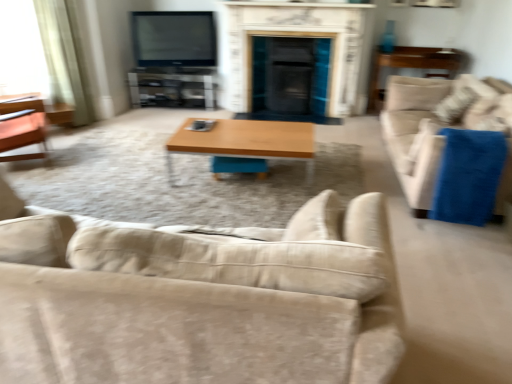
Question: Does wooden/matte coffee table at center contain beige fabric couch at right, which is the 1th studio couch in back-to-front order?

Choices:
 (A) yes
 (B) no

Answer: (B)

Question: From a real-world perspective, is wooden/matte coffee table at center beneath beige fabric couch at right, which is the 1th studio couch in back-to-front order?

Choices:
 (A) yes
 (B) no

Answer: (A)

Question: Is beige fabric couch at right, which is counted as the first studio couch, starting from the right, at the back of wooden/matte coffee table at center?

Choices:
 (A) no
 (B) yes

Answer: (A)

Question: Considering the relative positions of wooden/matte coffee table at center and beige fabric couch at right, which is the 1th studio couch in back-to-front order, in the image provided, is wooden/matte coffee table at center in front of beige fabric couch at right, which is the 1th studio couch in back-to-front order,?

Choices:
 (A) no
 (B) yes

Answer: (A)

Question: Considering the relative sizes of wooden/matte coffee table at center and beige fabric couch at right, which is counted as the first studio couch, starting from the right, in the image provided, is wooden/matte coffee table at center thinner than beige fabric couch at right, which is counted as the first studio couch, starting from the right,?

Choices:
 (A) yes
 (B) no

Answer: (A)

Question: From their relative heights in the image, would you say matte black tv at upper center is taller or shorter than clear glass entertainment center at center?

Choices:
 (A) short
 (B) tall

Answer: (B)

Question: In terms of width, does matte black tv at upper center look wider or thinner when compared to clear glass entertainment center at center?

Choices:
 (A) wide
 (B) thin

Answer: (B)

Question: In the image, is matte black tv at upper center on the left side or the right side of clear glass entertainment center at center?

Choices:
 (A) left
 (B) right

Answer: (B)

Question: Is matte black tv at upper center situated inside clear glass entertainment center at center or outside?

Choices:
 (A) inside
 (B) outside

Answer: (B)

Question: Is matte black tv at upper center taller or shorter than light beige fabric curtain at left?

Choices:
 (A) short
 (B) tall

Answer: (A)

Question: Is matte black tv at upper center situated inside light beige fabric curtain at left or outside?

Choices:
 (A) outside
 (B) inside

Answer: (A)

Question: Looking at their shapes, would you say matte black tv at upper center is wider or thinner than light beige fabric curtain at left?

Choices:
 (A) thin
 (B) wide

Answer: (A)

Question: Considering the positions of matte black tv at upper center and light beige fabric curtain at left in the image, is matte black tv at upper center bigger or smaller than light beige fabric curtain at left?

Choices:
 (A) big
 (B) small

Answer: (B)

Question: Do you think beige fabric couch at lower center, which appears as the first studio couch when viewed from the left, is within white marble fireplace at center, or outside of it?

Choices:
 (A) inside
 (B) outside

Answer: (B)

Question: From the image's perspective, relative to white marble fireplace at center, is beige fabric couch at lower center, the second studio couch in the right-to-left sequence, above or below?

Choices:
 (A) below
 (B) above

Answer: (A)